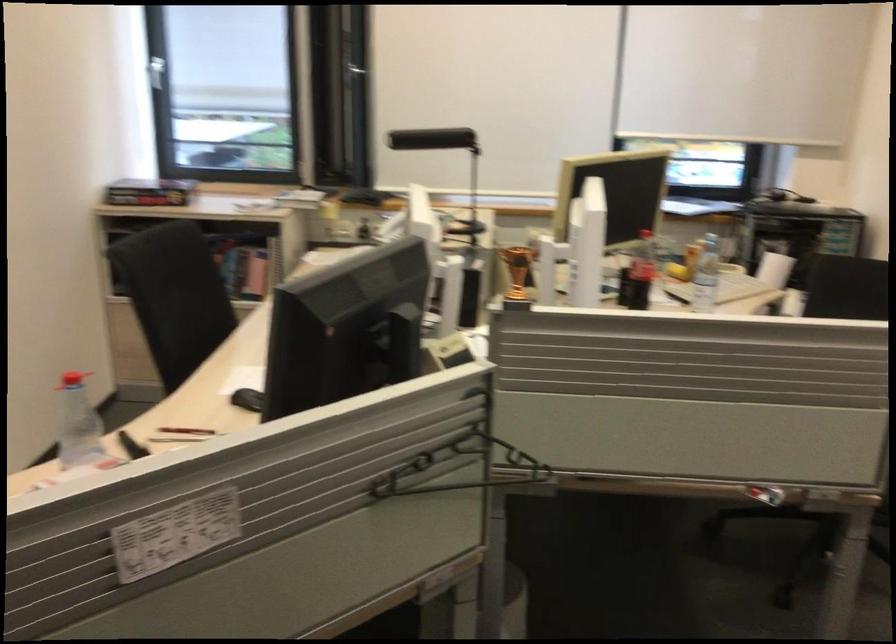
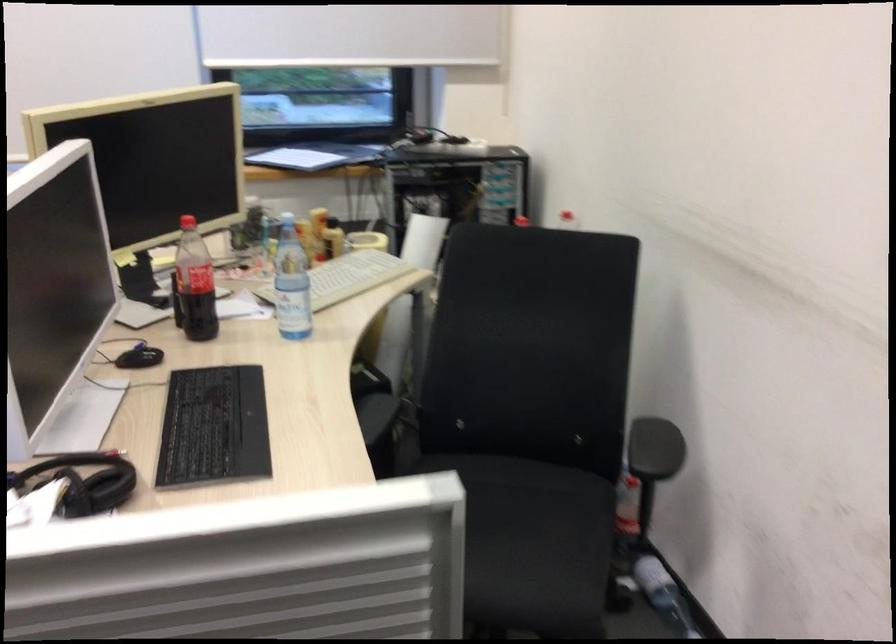
Locate, in the second image, the point that corresponds to (725,283) in the first image.

(347, 277)